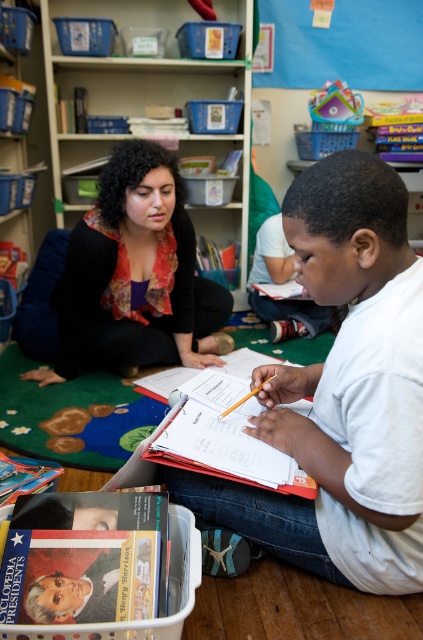
Question: Which point is closer to the camera?

Choices:
 (A) (87, 232)
 (B) (285, 243)
 (C) (65, 164)

Answer: (A)

Question: Which object appears closest to the camera in this image?

Choices:
 (A) matte black sweater at center
 (B) white matte shirt at lower right
 (C) white matte shirt at center
 (D) white paper at center

Answer: (C)

Question: Which object is farther from the camera taking this photo?

Choices:
 (A) white matte shirt at lower right
 (B) white matte shirt at center
 (C) wooden bookshelf at upper center
 (D) white paper at center

Answer: (C)

Question: Can you confirm if matte black sweater at center is positioned above white matte shirt at lower right?

Choices:
 (A) yes
 (B) no

Answer: (A)

Question: Is white matte shirt at center further to the viewer compared to white matte shirt at lower right?

Choices:
 (A) yes
 (B) no

Answer: (B)

Question: Does white matte shirt at center lie in front of white matte shirt at lower right?

Choices:
 (A) no
 (B) yes

Answer: (B)